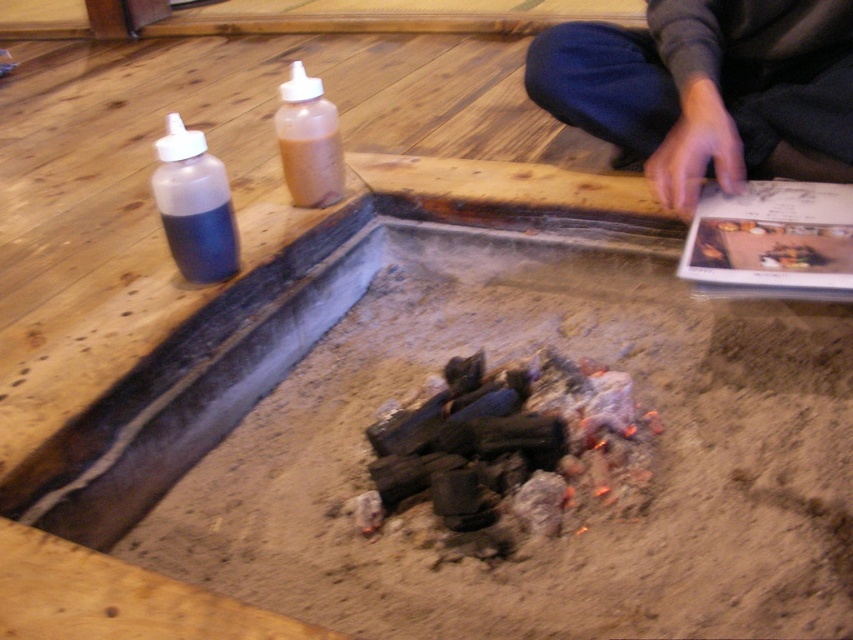
Question: Which point is farther from the camera taking this photo?

Choices:
 (A) (163, 204)
 (B) (328, 112)

Answer: (B)

Question: Is dark gray sweater at upper right positioned in front of transparent plastic bottle at left?

Choices:
 (A) no
 (B) yes

Answer: (A)

Question: Where is dark gray sweater at upper right located in relation to translucent plastic bottle at center in the image?

Choices:
 (A) left
 (B) right

Answer: (B)

Question: Is dark gray sweater at upper right thinner than transparent plastic bottle at left?

Choices:
 (A) no
 (B) yes

Answer: (A)

Question: Which point is closer to the camera taking this photo?

Choices:
 (A) (798, 28)
 (B) (286, 90)
 (C) (201, 148)

Answer: (C)

Question: Which point appears closest to the camera in this image?

Choices:
 (A) (311, 90)
 (B) (229, 248)
 (C) (628, 125)

Answer: (B)